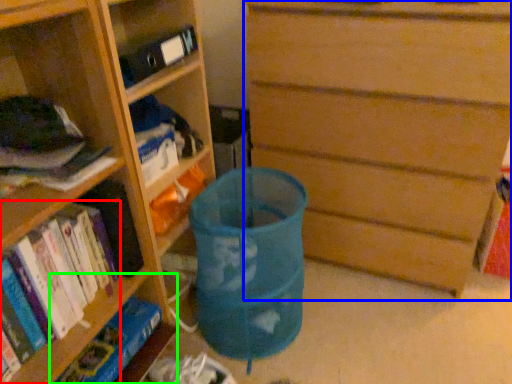
Question: Which object is positioned farthest from book (highlighted by a red box)? Select from chest of drawers (highlighted by a blue box) and shelf (highlighted by a green box).

Choices:
 (A) chest of drawers
 (B) shelf

Answer: (A)